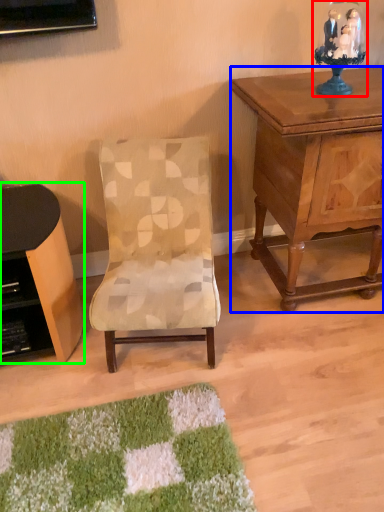
Question: Estimate the real-world distances between objects in this image. Which object is closer to table lamp (highlighted by a red box), nightstand (highlighted by a blue box) or desk (highlighted by a green box)?

Choices:
 (A) nightstand
 (B) desk

Answer: (A)